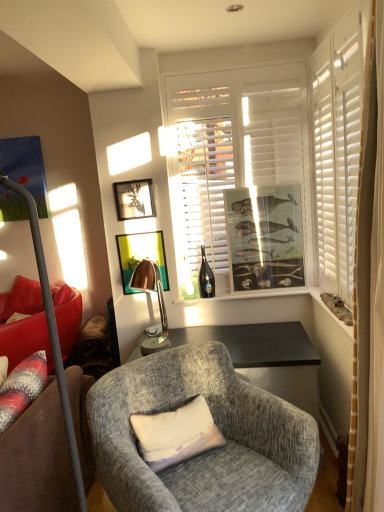
Locate an element on the screen. The width and height of the screenshot is (384, 512). vacant area that lies between matte wooden picture frame at center, the first picture frame in the right-to-left sequence, and translucent glass bottle at center is located at coordinates (253, 294).